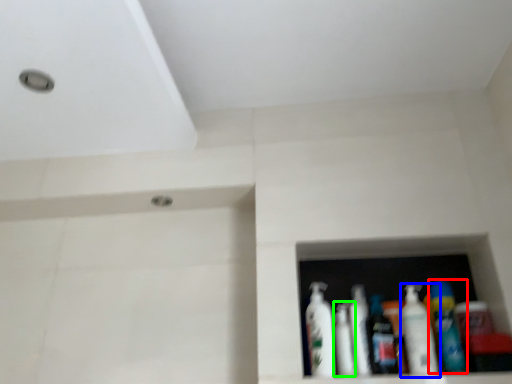
Question: Which object is the closest to the bottle (highlighted by a red box)? Choose among these: bottle (highlighted by a blue box) or mouthwash (highlighted by a green box).

Choices:
 (A) bottle
 (B) mouthwash

Answer: (A)